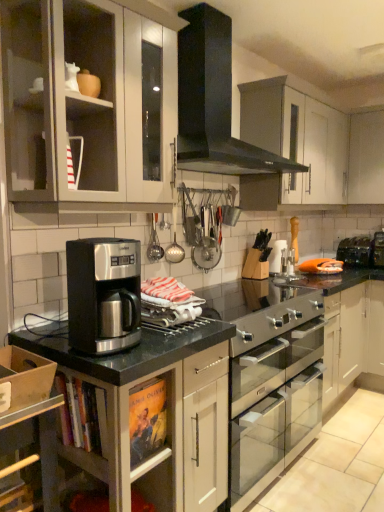
Question: Can you confirm if white matte cabinet at upper right, which is the 1th cabinetry in right-to-left order, is wider than black matte gas stove at upper center?

Choices:
 (A) no
 (B) yes

Answer: (A)

Question: Is white matte cabinet at upper right, which ranks as the third cabinetry in left-to-right order, positioned before black matte gas stove at upper center?

Choices:
 (A) yes
 (B) no

Answer: (B)

Question: Considering the relative sizes of white matte cabinet at upper right, which ranks as the third cabinetry in left-to-right order, and black matte gas stove at upper center in the image provided, is white matte cabinet at upper right, which ranks as the third cabinetry in left-to-right order, shorter than black matte gas stove at upper center?

Choices:
 (A) yes
 (B) no

Answer: (A)

Question: From the image's perspective, is white matte cabinet at upper right, the 3th cabinetry positioned from the front, below black matte gas stove at upper center?

Choices:
 (A) no
 (B) yes

Answer: (B)

Question: Can you confirm if white matte cabinet at upper right, the 3th cabinetry positioned from the front, is positioned to the left of black matte gas stove at upper center?

Choices:
 (A) no
 (B) yes

Answer: (A)

Question: Which is correct: matte white cabinet at upper left, which is the 2th cabinetry in top-to-bottom order, is inside satin silver cabinet at lower left, the 1th cabinetry in the bottom-to-top sequence, or outside of it?

Choices:
 (A) outside
 (B) inside

Answer: (A)

Question: From a real-world perspective, is matte white cabinet at upper left, the 1th cabinetry positioned from the left, positioned above or below satin silver cabinet at lower left, positioned as the 2th cabinetry in left-to-right order?

Choices:
 (A) above
 (B) below

Answer: (A)

Question: Relative to satin silver cabinet at lower left, which is the 1th cabinetry in front-to-back order, is matte white cabinet at upper left, which is the 3th cabinetry in right-to-left order, in front or behind?

Choices:
 (A) behind
 (B) front

Answer: (A)

Question: From their relative heights in the image, would you say matte white cabinet at upper left, the 1th cabinetry positioned from the left, is taller or shorter than satin silver cabinet at lower left, positioned as the 2th cabinetry in left-to-right order?

Choices:
 (A) tall
 (B) short

Answer: (B)

Question: Which is correct: satin black coffee maker at center is inside white matte cabinet at upper right, which ranks as the third cabinetry in left-to-right order, or outside of it?

Choices:
 (A) outside
 (B) inside

Answer: (A)

Question: From a real-world perspective, is satin black coffee maker at center positioned above or below white matte cabinet at upper right, which ranks as the third cabinetry in left-to-right order?

Choices:
 (A) below
 (B) above

Answer: (A)

Question: Based on their sizes in the image, would you say satin black coffee maker at center is bigger or smaller than white matte cabinet at upper right, which is the 1th cabinetry in right-to-left order?

Choices:
 (A) small
 (B) big

Answer: (A)

Question: From the image's perspective, is satin black coffee maker at center located above or below white matte cabinet at upper right, the first cabinetry positioned from the back?

Choices:
 (A) below
 (B) above

Answer: (A)

Question: Visually, is satin black coffee maker at center positioned to the left or to the right of matte white cabinet at upper left, which is the 3th cabinetry in right-to-left order?

Choices:
 (A) left
 (B) right

Answer: (B)

Question: Based on their sizes in the image, would you say satin black coffee maker at center is bigger or smaller than matte white cabinet at upper left, acting as the second cabinetry starting from the front?

Choices:
 (A) big
 (B) small

Answer: (B)